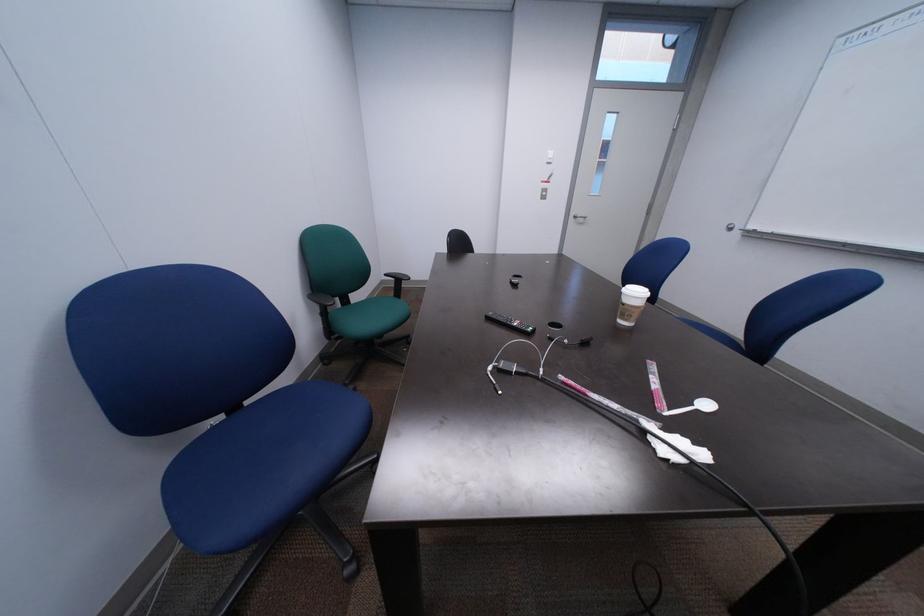
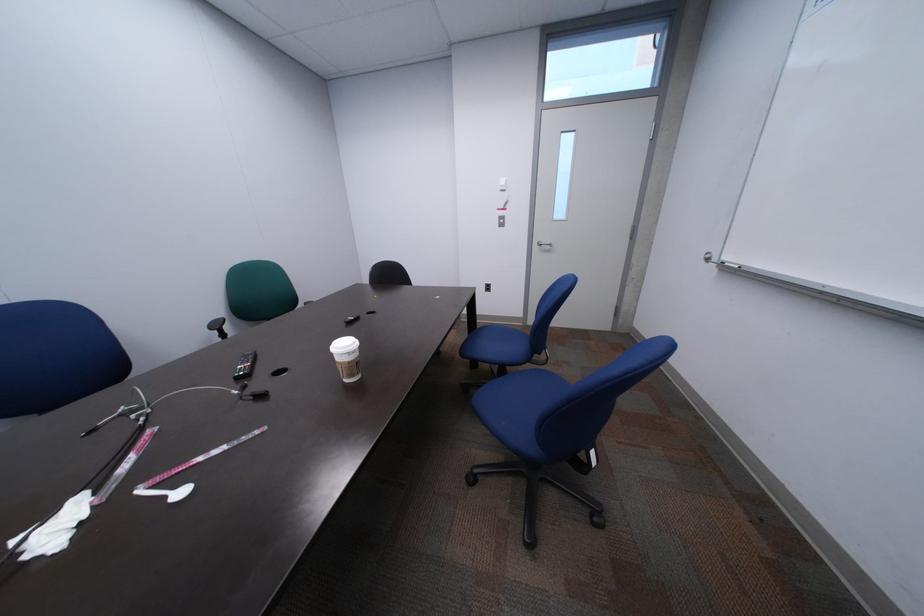
Question: The images are taken continuously from a first-person perspective. In which direction are you moving?

Choices:
 (A) Left
 (B) Right
 (C) Forward
 (D) Backward

Answer: (B)